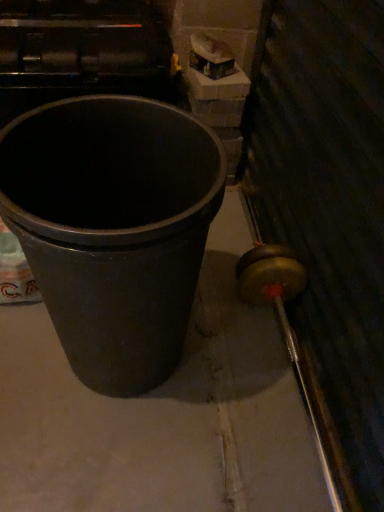
This screenshot has width=384, height=512. What are the coordinates of `black plastic trash can at left` in the screenshot? It's located at [x=113, y=228].

The image size is (384, 512). Describe the element at coordinates (113, 228) in the screenshot. I see `black plastic trash can at left` at that location.

Measure the distance between point [144,183] and camera.

Point [144,183] is 37.01 inches away from camera.

Describe the element at coordinates (163, 412) in the screenshot. I see `matte black bucket at center-left` at that location.

Where is `matte black bucket at center-left`? The width and height of the screenshot is (384, 512). matte black bucket at center-left is located at coordinates (163, 412).

Measure the distance between point (293, 388) and camera.

The depth of point (293, 388) is 3.45 feet.

Find the location of a particular element. This screenshot has height=512, width=384. black plastic trash can at left is located at coordinates (113, 228).

Which is more to the left, black plastic trash can at left or matte black bucket at center-left?

black plastic trash can at left is more to the left.

Based on the photo, between black plastic trash can at left and matte black bucket at center-left, which one is positioned behind?

matte black bucket at center-left is more distant.

Considering the points (35, 263) and (226, 430), which point is in front, point (35, 263) or point (226, 430)?

The point (35, 263) is closer.

From the image's perspective, relative to matte black bucket at center-left, is black plastic trash can at left above or below?

Based on their image positions, black plastic trash can at left is located above matte black bucket at center-left.

From a real-world perspective, who is located higher, black plastic trash can at left or matte black bucket at center-left?

black plastic trash can at left.

Considering the sizes of black plastic trash can at left and matte black bucket at center-left in the image, is black plastic trash can at left wider or thinner than matte black bucket at center-left?

In the image, black plastic trash can at left appears to be more narrow than matte black bucket at center-left.

Which of these two, black plastic trash can at left or matte black bucket at center-left, stands taller?

black plastic trash can at left is taller.

Considering the sizes of objects black plastic trash can at left and matte black bucket at center-left in the image provided, who is bigger, black plastic trash can at left or matte black bucket at center-left?

A: Bigger between the two is black plastic trash can at left.

Would you say black plastic trash can at left contains matte black bucket at center-left?

No.

Would you consider black plastic trash can at left to be distant from matte black bucket at center-left?

black plastic trash can at left is near matte black bucket at center-left, not far away.

Is black plastic trash can at left oriented towards matte black bucket at center-left?

No, black plastic trash can at left is not aimed at matte black bucket at center-left.

How many degrees apart are the facing directions of black plastic trash can at left and matte black bucket at center-left?

The angular difference between black plastic trash can at left and matte black bucket at center-left is 11.1 degrees.

Identify the location of waste container lying on the left of matte black bucket at center-left. (113, 228).

Between matte black bucket at center-left and black plastic trash can at left, which one appears on the right side from the viewer's perspective?

matte black bucket at center-left.

Based on the photo, which is in front, matte black bucket at center-left or black plastic trash can at left?

black plastic trash can at left is more forward.

Considering the positions of point (55, 401) and point (75, 199), is point (55, 401) closer or farther from the camera than point (75, 199)?

Point (55, 401) appears to be farther away from the viewer than point (75, 199).

From the image's perspective, is matte black bucket at center-left above or below black plastic trash can at left?

From the image's perspective, matte black bucket at center-left appears below black plastic trash can at left.

From a real-world perspective, is matte black bucket at center-left positioned above or below black plastic trash can at left?

matte black bucket at center-left is below black plastic trash can at left.

Which object is thinner, matte black bucket at center-left or black plastic trash can at left?

black plastic trash can at left is thinner.

Is matte black bucket at center-left taller than black plastic trash can at left?

No, matte black bucket at center-left is not taller than black plastic trash can at left.

Considering the sizes of matte black bucket at center-left and black plastic trash can at left in the image, is matte black bucket at center-left bigger or smaller than black plastic trash can at left?

In the image, matte black bucket at center-left appears to be smaller than black plastic trash can at left.

Is matte black bucket at center-left located outside black plastic trash can at left?

Indeed, matte black bucket at center-left is completely outside black plastic trash can at left.

Is matte black bucket at center-left far from black plastic trash can at left?

Actually, matte black bucket at center-left and black plastic trash can at left are a little close together.

In the scene shown: Is matte black bucket at center-left facing away from black plastic trash can at left?

No, matte black bucket at center-left's orientation is not away from black plastic trash can at left.

From the picture: Can you tell me how much matte black bucket at center-left and black plastic trash can at left differ in facing direction?

11.1 degrees separate the facing orientations of matte black bucket at center-left and black plastic trash can at left.

How distant is matte black bucket at center-left from black plastic trash can at left?

matte black bucket at center-left is 31.98 centimeters away from black plastic trash can at left.

Find the location of `concrete below the black plastic trash can at left (from the image's perspective)`. concrete below the black plastic trash can at left (from the image's perspective) is located at coordinates (163, 412).

Locate an element on the screen. concrete below the black plastic trash can at left (from a real-world perspective) is located at coordinates (163, 412).

Where is `concrete on the right of black plastic trash can at left`? concrete on the right of black plastic trash can at left is located at coordinates (163, 412).